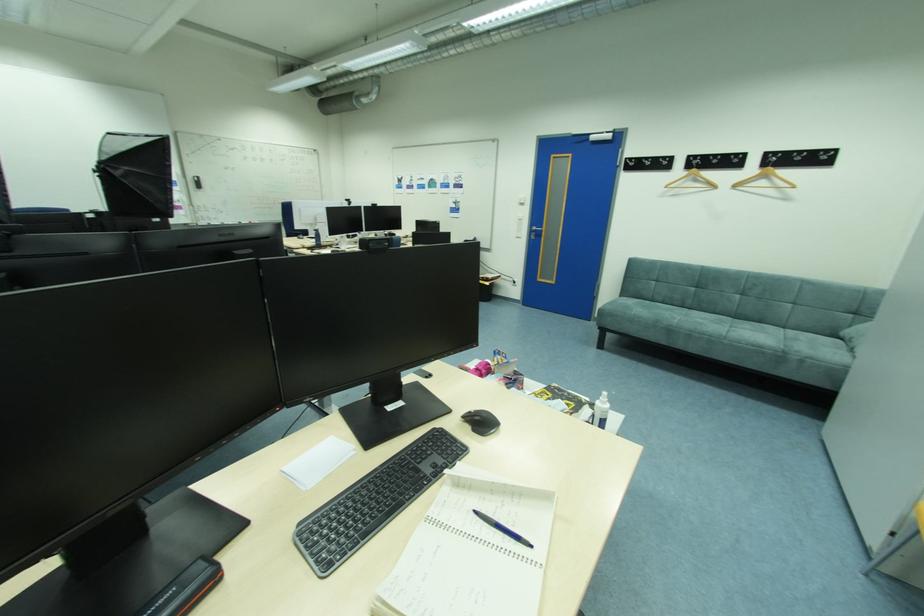
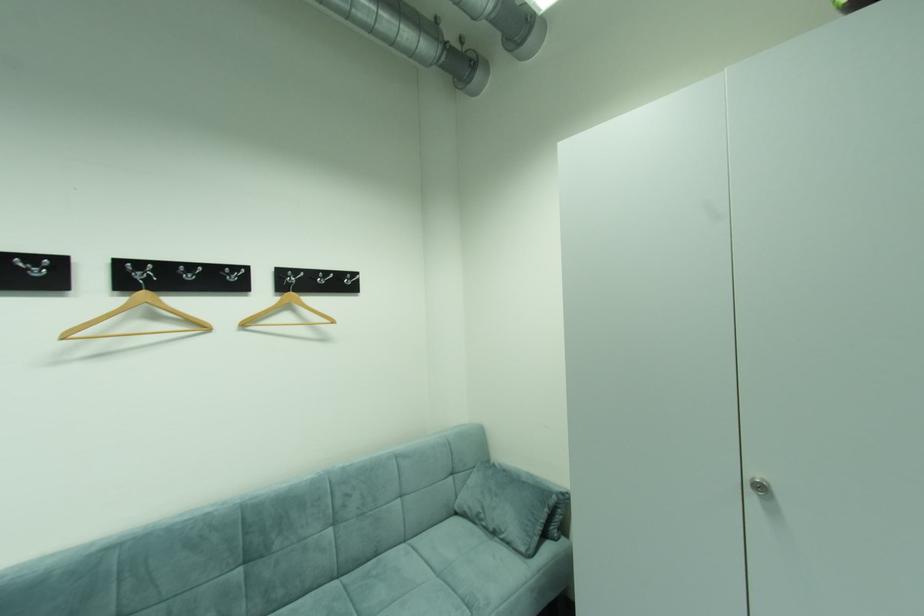
Find the pixel in the second image that matches point (742, 188) in the first image.

(251, 326)